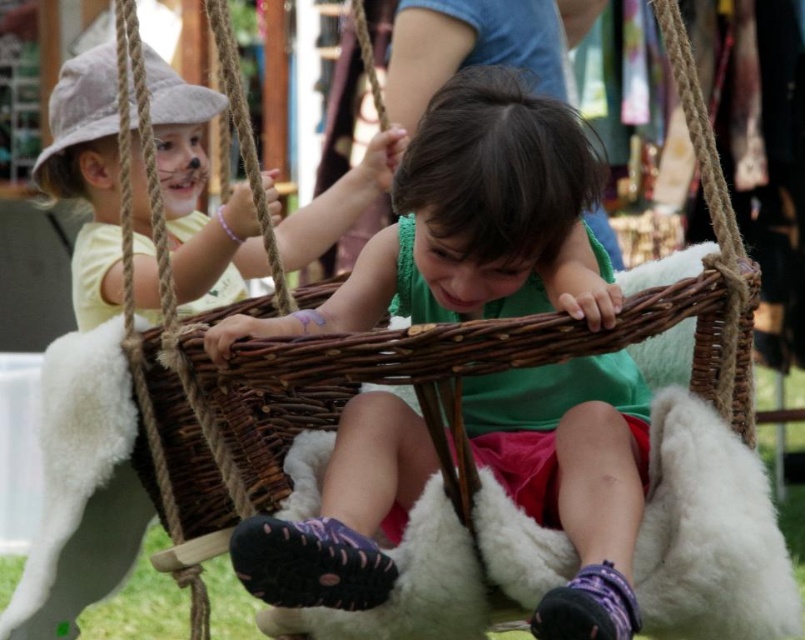
Between matte wicker basket at center and matte yellow shirt at left, which one is positioned higher?

matte yellow shirt at left

Can you confirm if matte wicker basket at center is shorter than matte yellow shirt at left?

Indeed, matte wicker basket at center has a lesser height compared to matte yellow shirt at left.

Is point (407, 248) behind point (105, 186)?

No, it is in front of (105, 186).

Locate an element on the screen. Image resolution: width=805 pixels, height=640 pixels. matte wicker basket at center is located at coordinates (460, 216).

Based on the photo, is matte wicker basket at center positioned before white fluffy cushion at center?

That is True.

Can you confirm if matte wicker basket at center is bigger than white fluffy cushion at center?

Yes, matte wicker basket at center is bigger than white fluffy cushion at center.

Locate an element on the screen. The height and width of the screenshot is (640, 805). matte wicker basket at center is located at coordinates (460, 216).

At what (x,y) coordinates should I click in order to perform the action: click on matte wicker basket at center. Please return your answer as a coordinate pair (x, y). This screenshot has width=805, height=640. Looking at the image, I should click on (460, 216).

Can you confirm if white fluffy cushion at center is positioned above matte yellow shirt at left?

Incorrect, white fluffy cushion at center is not positioned above matte yellow shirt at left.

Which is below, white fluffy cushion at center or matte yellow shirt at left?

white fluffy cushion at center

Find the location of a particular element. white fluffy cushion at center is located at coordinates (709, 532).

Where is `white fluffy cushion at center`? white fluffy cushion at center is located at coordinates (709, 532).